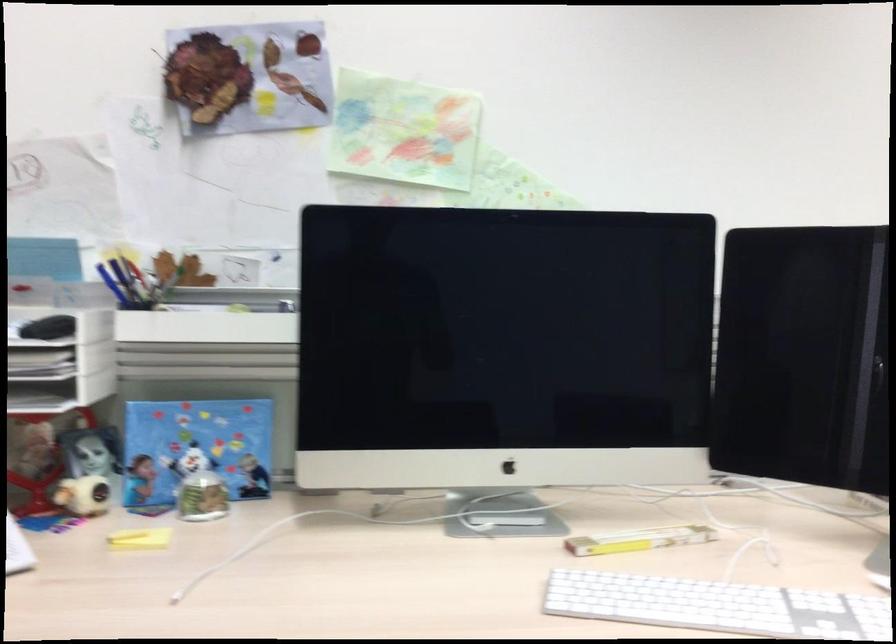
Where is `black computer mouse`? The image size is (896, 644). black computer mouse is located at coordinates (47, 328).